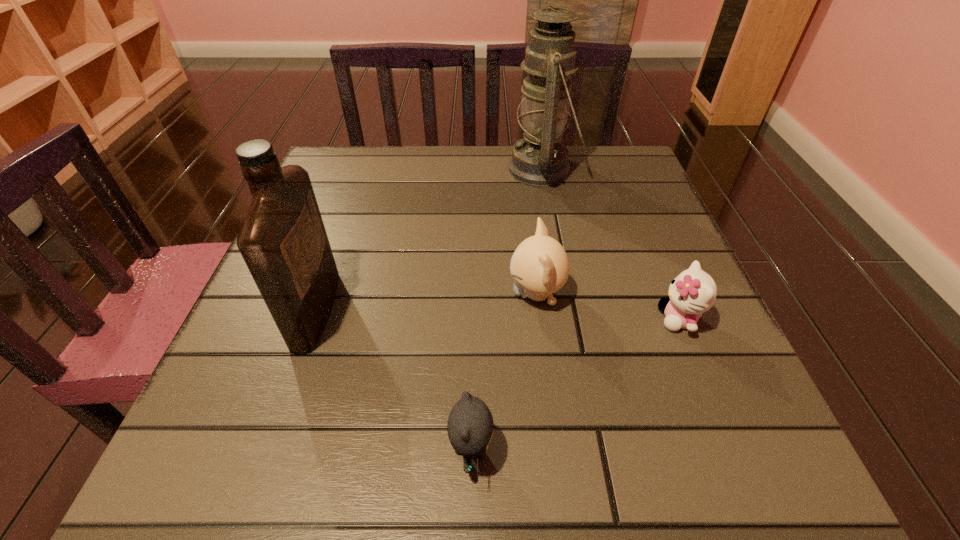
Locate an element on the screen. The width and height of the screenshot is (960, 540). free region located 0.170m on the face of the tallest kitten is located at coordinates [x=414, y=294].

You are a GUI agent. You are given a task and a screenshot of the screen. Output one action in this format:
    pyautogui.click(x=<x>, y=<y>)
    Task: Click on the free region located 0.180m on the face of the tallest kitten
    The image size is (960, 540).
    Given the screenshot: What is the action you would take?
    pyautogui.click(x=408, y=294)

Locate an element on the screen. vacant area situated on the face of the tallest kitten is located at coordinates (475, 294).

In order to click on free point located on the front-facing side of the rightmost kitten in this screenshot , I will do `click(540, 319)`.

Locate an element on the screen. This screenshot has height=540, width=960. vacant space located on the front-facing side of the rightmost kitten is located at coordinates (611, 319).

You are a GUI agent. You are given a task and a screenshot of the screen. Output one action in this format:
    pyautogui.click(x=<x>, y=<y>)
    Task: Click on the free space located 0.060m on the front-facing side of the rightmost kitten
    The width and height of the screenshot is (960, 540).
    Given the screenshot: What is the action you would take?
    pyautogui.click(x=623, y=319)

Where is `vacant space located 0.160m on the front-facing side of the nearest object`? Image resolution: width=960 pixels, height=540 pixels. vacant space located 0.160m on the front-facing side of the nearest object is located at coordinates (613, 450).

Locate an element on the screen. The width and height of the screenshot is (960, 540). object that is at the far edge is located at coordinates (540, 159).

Identify the location of object located at the near edge. The image size is (960, 540). (470, 423).

The height and width of the screenshot is (540, 960). Identify the location of object situated at the left edge. (283, 241).